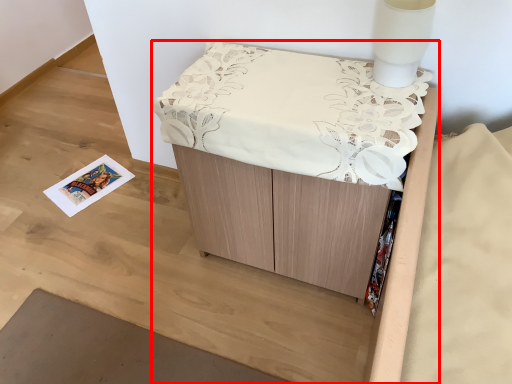
Question: Observing the image, what is the correct spatial positioning of furniture (annotated by the red box) in reference to table lamp?

Choices:
 (A) left
 (B) right

Answer: (A)